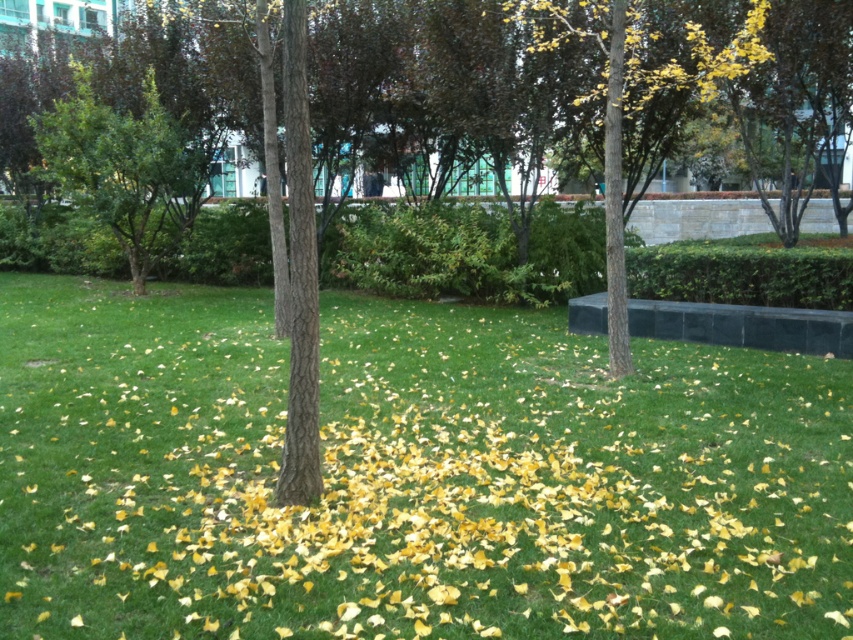
Question: Is green leafy tree at left bigger than yellow-green leaves at center?

Choices:
 (A) yes
 (B) no

Answer: (A)

Question: Which object appears farthest from the camera in this image?

Choices:
 (A) yellow-green leaves at center
 (B) green leafy tree at left

Answer: (B)

Question: Based on their relative distances, which object is farther from the yellow leaf litter at center?

Choices:
 (A) green leafy tree at left
 (B) yellow-green leaves at center

Answer: (B)

Question: Where is yellow leaf litter at center located in relation to yellow-green leaves at center in the image?

Choices:
 (A) below
 (B) above

Answer: (A)

Question: Is green leafy tree at left below yellow-green leaves at center?

Choices:
 (A) no
 (B) yes

Answer: (B)

Question: Which object is the farthest from the green leafy tree at left?

Choices:
 (A) yellow leaf litter at center
 (B) yellow-green leaves at center

Answer: (B)